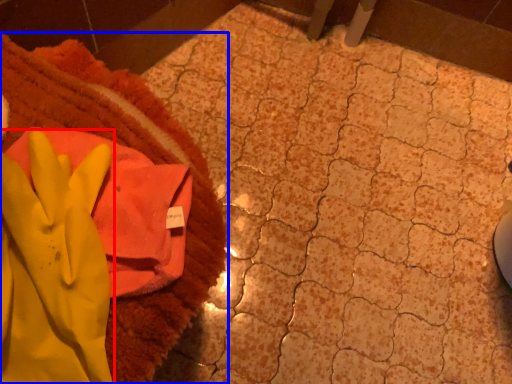
Question: Which object is further to the camera taking this photo, glove (highlighted by a red box) or towel (highlighted by a blue box)?

Choices:
 (A) glove
 (B) towel

Answer: (B)